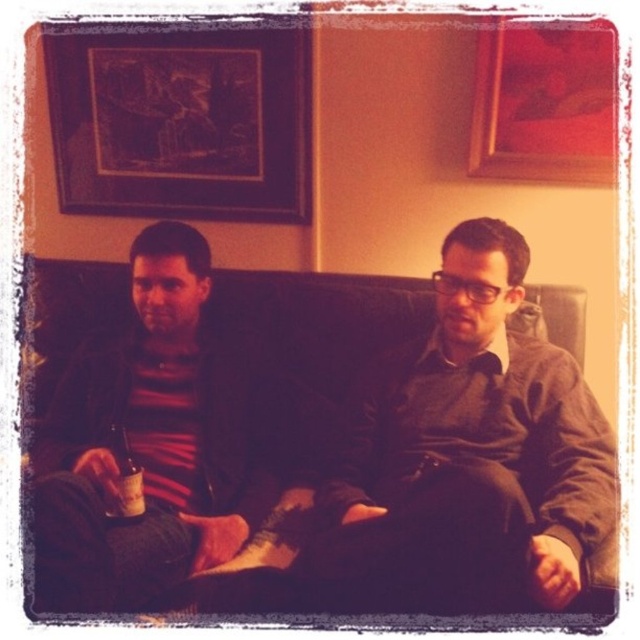
You are an interior designer planning to place a new lamp at point (180, 122). Is there already an object at that location in the scene?

Yes, there is a wooden framed artwork at upper left located at point (180, 122).

You are organizing a small party and need to place a decorative bottle on the table. The wooden framed artwork at upper left and the amber glass bottle at lower left are in the room. Which object should you avoid placing the bottle near to ensure it doesn t get damaged?

You should avoid placing the decorative bottle near the wooden framed artwork at upper left because it is larger in size than the amber glass bottle at lower left, so it might accidentally knock over the smaller bottle.

You are taking a photo of two people sitting on a couch. The scene has a warm, dim lighting. You notice two points marked in the image. One is at point (x=104, y=532) and the other at point (x=586, y=131). Which point is closer to you when you take the photo?

Point (x=104, y=532) is closer to the camera than point (x=586, y=131).